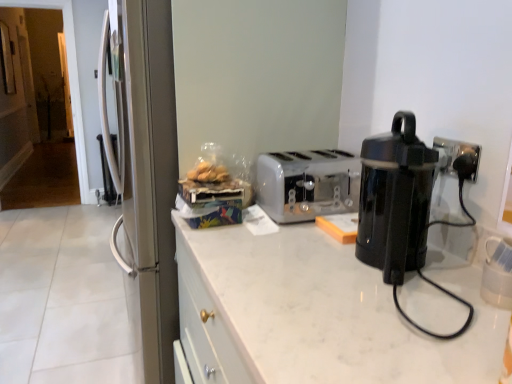
Question: In terms of height, does black plastic coffee pot at right look taller or shorter compared to white marble countertop at center?

Choices:
 (A) short
 (B) tall

Answer: (A)

Question: Considering their positions, is black plastic coffee pot at right located in front of or behind white marble countertop at center?

Choices:
 (A) behind
 (B) front

Answer: (A)

Question: Which of these objects is positioned closest to the white marble countertop at center?

Choices:
 (A) white plastic toaster at center
 (B) translucent plastic bag of bread at center
 (C) black plastic coffee pot at right

Answer: (C)

Question: Which of these objects is positioned farthest from the black plastic coffee pot at right?

Choices:
 (A) white plastic toaster at center
 (B) white marble countertop at center
 (C) translucent plastic bag of bread at center

Answer: (C)